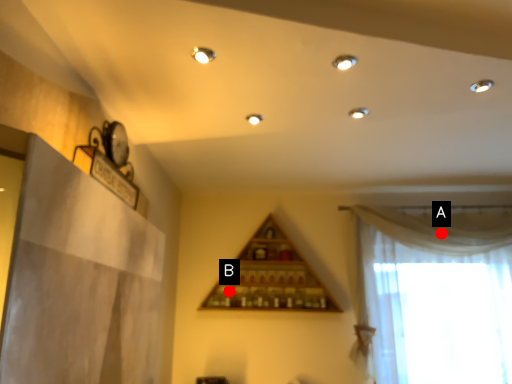
Question: Two points are circled on the image, labeled by A and B beside each circle. Which point is farther to the camera?

Choices:
 (A) A is further
 (B) B is further

Answer: (B)